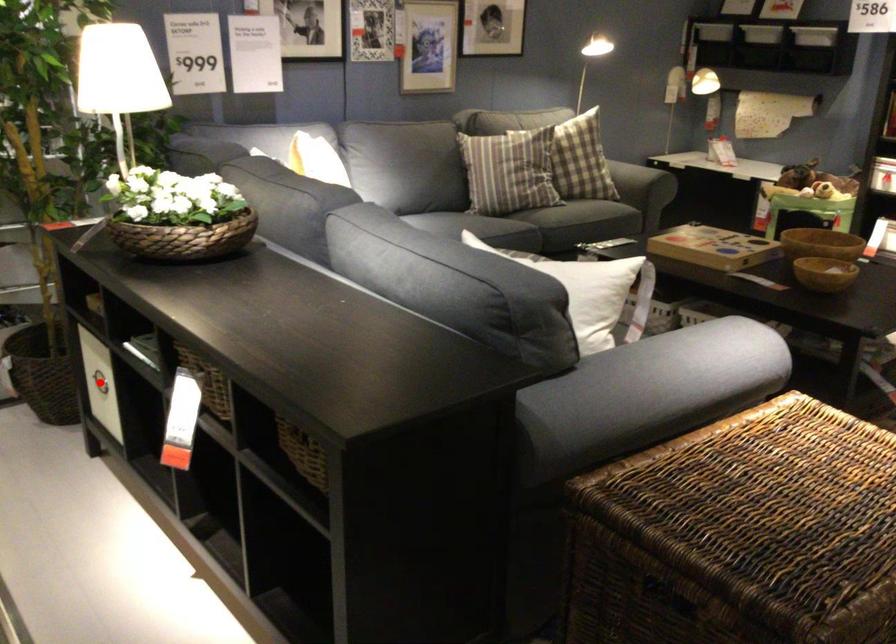
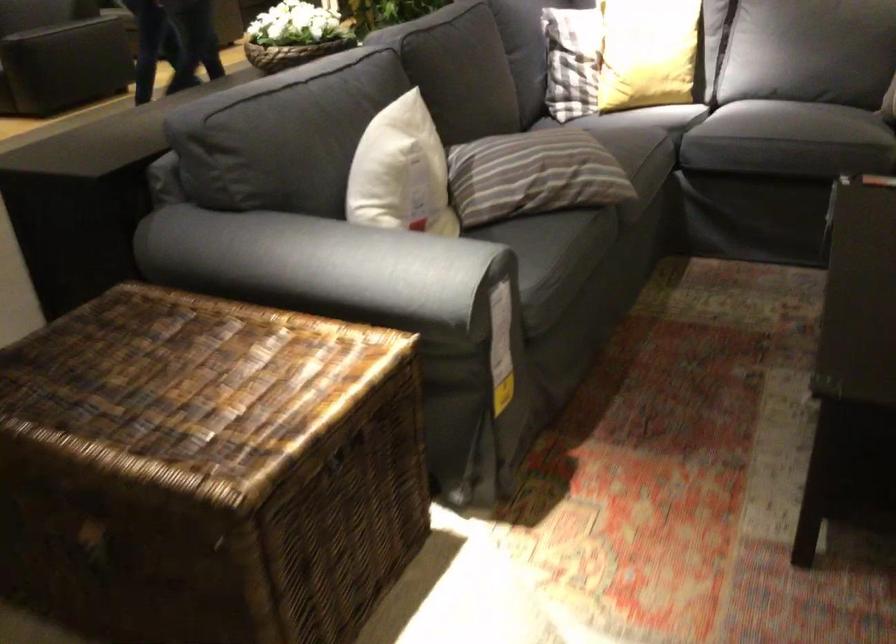
Question: I am providing you with two images of the same scene from different viewpoints. A red point is marked on the first image. Can you still see the location of the red point in image 2?

Choices:
 (A) Yes
 (B) No

Answer: (B)